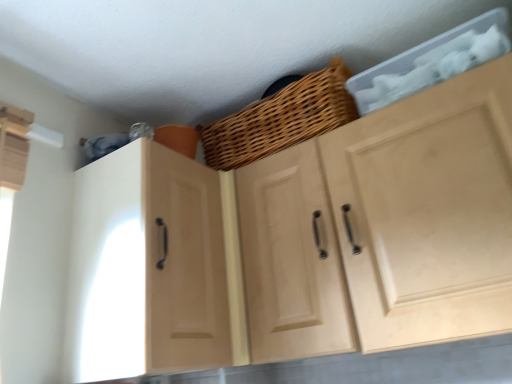
Question: Is natural wood cabinet at upper center, marked as the 1th cabinetry in a right-to-left arrangement, oriented away from matte wood cabinet at left, positioned as the first cabinetry in left-to-right order?

Choices:
 (A) yes
 (B) no

Answer: (B)

Question: Would you say matte wood cabinet at left, the second cabinetry viewed from the right, is part of natural wood cabinet at upper center, marked as the 1th cabinetry in a right-to-left arrangement,'s contents?

Choices:
 (A) no
 (B) yes

Answer: (A)

Question: Does natural wood cabinet at upper center, marked as the 1th cabinetry in a right-to-left arrangement, have a lesser width compared to matte wood cabinet at left, the second cabinetry viewed from the right?

Choices:
 (A) no
 (B) yes

Answer: (B)

Question: Can you confirm if natural wood cabinet at upper center, marked as the 1th cabinetry in a right-to-left arrangement, is taller than matte wood cabinet at left, positioned as the first cabinetry in left-to-right order?

Choices:
 (A) yes
 (B) no

Answer: (A)

Question: Can you confirm if natural wood cabinet at upper center, the 2th cabinetry viewed from the left, is shorter than matte wood cabinet at left, the second cabinetry viewed from the right?

Choices:
 (A) no
 (B) yes

Answer: (A)

Question: From a real-world perspective, is natural wood cabinet at upper center, the 2th cabinetry viewed from the left, physically located above or below matte wood cabinet at left, positioned as the first cabinetry in left-to-right order?

Choices:
 (A) above
 (B) below

Answer: (B)

Question: Is natural wood cabinet at upper center, the 2th cabinetry viewed from the left, wider or thinner than matte wood cabinet at left, the second cabinetry viewed from the right?

Choices:
 (A) thin
 (B) wide

Answer: (A)

Question: Considering the positions of point (412, 309) and point (219, 208), is point (412, 309) closer or farther from the camera than point (219, 208)?

Choices:
 (A) closer
 (B) farther

Answer: (A)

Question: Considering the relative positions of natural wood cabinet at upper center, marked as the 1th cabinetry in a right-to-left arrangement, and matte wood cabinet at left, the second cabinetry viewed from the right, in the image provided, is natural wood cabinet at upper center, marked as the 1th cabinetry in a right-to-left arrangement, to the left or to the right of matte wood cabinet at left, the second cabinetry viewed from the right,?

Choices:
 (A) left
 (B) right

Answer: (B)

Question: Considering the relative positions of matte wood cabinet at left, the second cabinetry viewed from the right, and natural wood cabinet at upper center, the 2th cabinetry viewed from the left, in the image provided, is matte wood cabinet at left, the second cabinetry viewed from the right, to the left or to the right of natural wood cabinet at upper center, the 2th cabinetry viewed from the left,?

Choices:
 (A) right
 (B) left

Answer: (B)

Question: From the image's perspective, is matte wood cabinet at left, the second cabinetry viewed from the right, positioned above or below natural wood cabinet at upper center, the 2th cabinetry viewed from the left?

Choices:
 (A) above
 (B) below

Answer: (B)

Question: Based on their sizes in the image, would you say matte wood cabinet at left, the second cabinetry viewed from the right, is bigger or smaller than natural wood cabinet at upper center, marked as the 1th cabinetry in a right-to-left arrangement?

Choices:
 (A) small
 (B) big

Answer: (A)

Question: Is matte wood cabinet at left, the second cabinetry viewed from the right, inside the boundaries of natural wood cabinet at upper center, the 2th cabinetry viewed from the left, or outside?

Choices:
 (A) outside
 (B) inside

Answer: (A)

Question: Is point (140, 337) closer or farther from the camera than point (268, 104)?

Choices:
 (A) farther
 (B) closer

Answer: (B)

Question: Is matte wood cabinet at left, the second cabinetry viewed from the right, taller or shorter than woven wood basket at upper center?

Choices:
 (A) tall
 (B) short

Answer: (A)